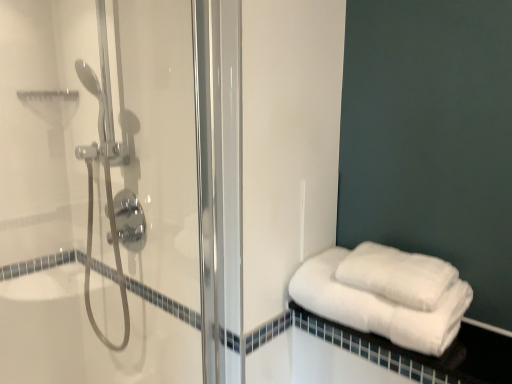
Question: Is white cotton towels at lower right touching white fluffy towels at lower right, which is the second towel from bottom to top?

Choices:
 (A) yes
 (B) no

Answer: (B)

Question: Does white cotton towels at lower right have a lesser height compared to white fluffy towels at lower right, the 1th towel from the top?

Choices:
 (A) yes
 (B) no

Answer: (A)

Question: Is white cotton towels at lower right wider than white fluffy towels at lower right, which is the second towel from bottom to top?

Choices:
 (A) no
 (B) yes

Answer: (B)

Question: Is white cotton towels at lower right located outside white fluffy towels at lower right, the 1th towel from the top?

Choices:
 (A) yes
 (B) no

Answer: (A)

Question: Considering the relative positions of white cotton towels at lower right and white fluffy towels at lower right, the 1th towel from the top, in the image provided, is white cotton towels at lower right to the left of white fluffy towels at lower right, the 1th towel from the top, from the viewer's perspective?

Choices:
 (A) yes
 (B) no

Answer: (B)

Question: From a real-world perspective, is white cotton towels at lower right located beneath white fluffy towels at lower right, which is the second towel from bottom to top?

Choices:
 (A) no
 (B) yes

Answer: (B)

Question: Is clear glass shower door at left wider than white fluffy towels at lower right, the 1th towel from the top?

Choices:
 (A) no
 (B) yes

Answer: (A)

Question: Is white fluffy towels at lower right, which is the second towel from bottom to top, at the back of clear glass shower door at left?

Choices:
 (A) no
 (B) yes

Answer: (A)

Question: Is clear glass shower door at left not near white fluffy towels at lower right, the 1th towel from the top?

Choices:
 (A) no
 (B) yes

Answer: (A)

Question: Is the position of clear glass shower door at left more distant than that of white fluffy towels at lower right, which is the second towel from bottom to top?

Choices:
 (A) yes
 (B) no

Answer: (B)

Question: From the image's perspective, is clear glass shower door at left located above white fluffy towels at lower right, the 1th towel from the top?

Choices:
 (A) yes
 (B) no

Answer: (A)

Question: Is clear glass shower door at left outside of white fluffy towels at lower right, the 1th towel from the top?

Choices:
 (A) no
 (B) yes

Answer: (B)

Question: Is clear glass shower door at left looking in the opposite direction of white fluffy towels at right, marked as the second towel in a top-to-bottom arrangement?

Choices:
 (A) no
 (B) yes

Answer: (A)